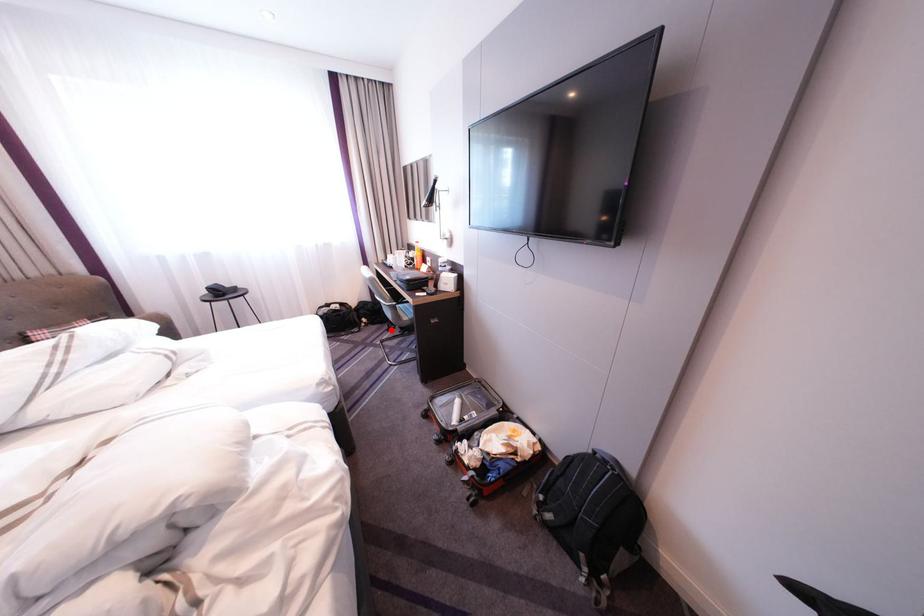
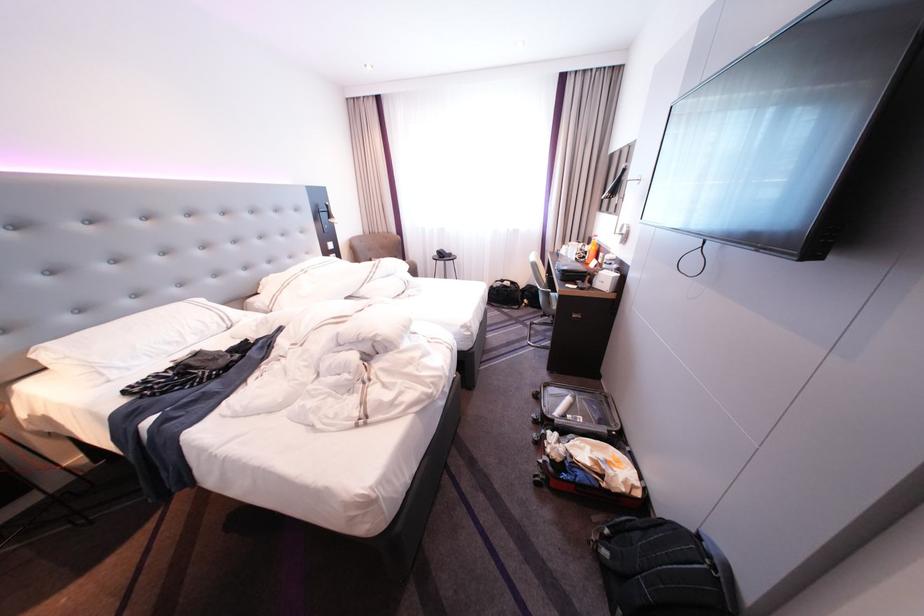
The point at the highlighted location is marked in the first image. Where is the corresponding point in the second image?

(546, 314)